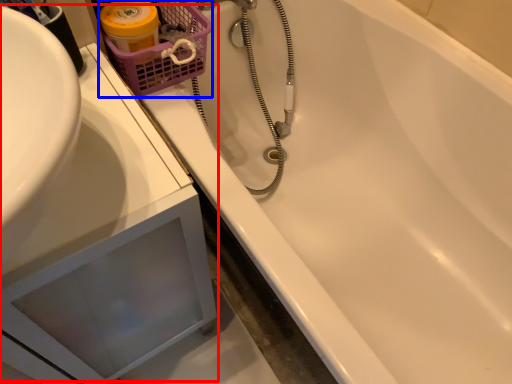
Question: Among these objects, which one is farthest to the camera, sink (highlighted by a red box) or basket (highlighted by a blue box)?

Choices:
 (A) sink
 (B) basket

Answer: (B)